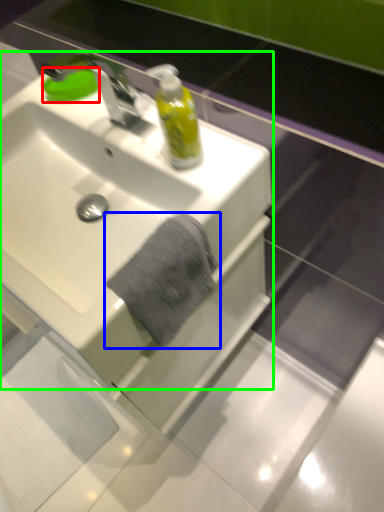
Question: Which object is positioned farthest from soap (highlighted by a red box)? Select from bath towel (highlighted by a blue box) and sink (highlighted by a green box).

Choices:
 (A) bath towel
 (B) sink

Answer: (A)